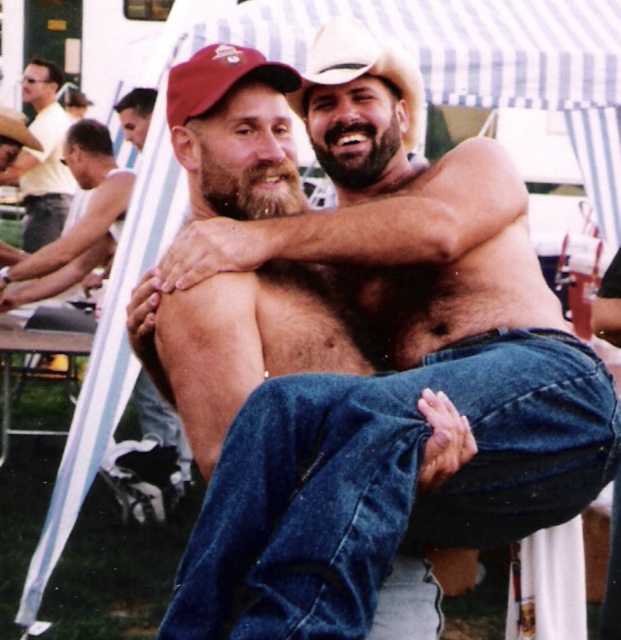
You are a photographer at the event and want to capture both the denim jeans at center and the brown hairy chest at left in a single frame. Which object should you focus on first to ensure both are in the frame?

The denim jeans at center has a lesser height compared to the brown hairy chest at left, so you should focus on the brown hairy chest at left first to ensure both are in the frame.

You are at a festival and see the denim jeans at center and the matte yellow shirt at upper left. Which item is located to the right of the other?

The denim jeans at center is positioned on the right side of matte yellow shirt at upper left.

You are a photographer at the event and need to frame a shot that includes both the denim jeans at center and the brown hairy chest at left. Which object should you adjust your camera angle to prioritize in terms of width to ensure both fit within the frame?

The denim jeans at center is wider than the brown hairy chest at left, so prioritize framing the denim jeans at center first to accommodate its greater width.